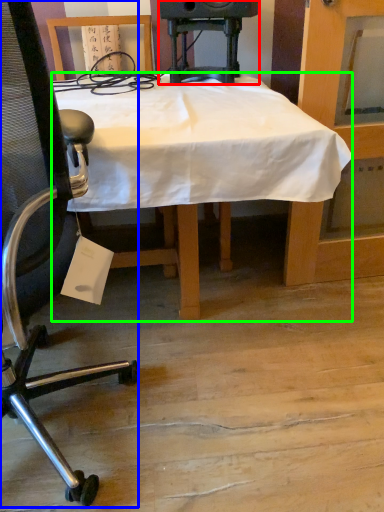
Question: Based on their relative distances, which object is farther from speaker (highlighted by a red box)? Choose from chair (highlighted by a blue box) and desk (highlighted by a green box).

Choices:
 (A) chair
 (B) desk

Answer: (A)